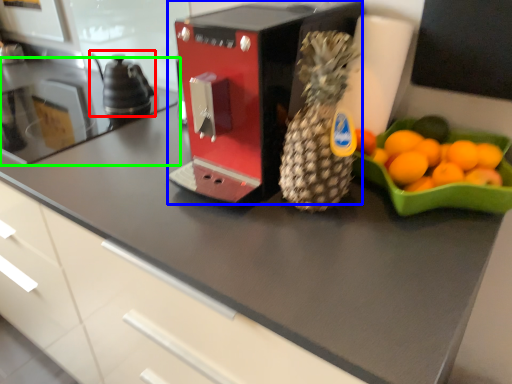
Question: Based on their relative distances, which object is nearer to tea pot (highlighted by a red box)? Choose from kitchen appliance (highlighted by a blue box) and countertop (highlighted by a green box).

Choices:
 (A) kitchen appliance
 (B) countertop

Answer: (B)